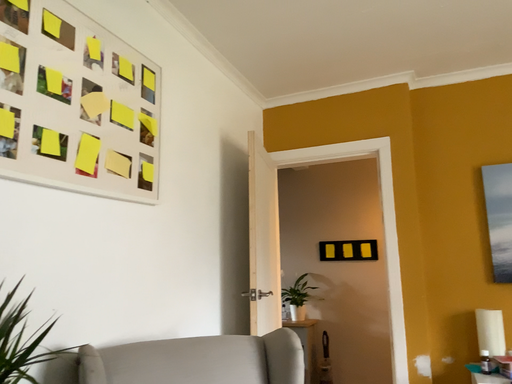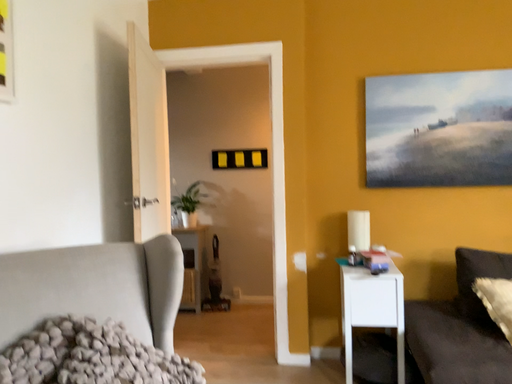
Question: Which way did the camera rotate in the video?

Choices:
 (A) rotated upward
 (B) rotated downward

Answer: (B)